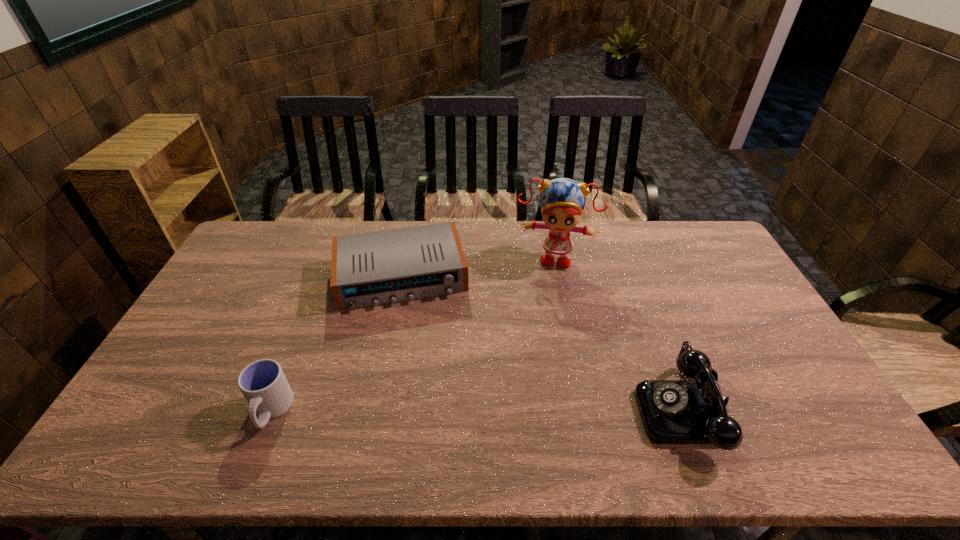
At what (x,y) coordinates should I click in order to perform the action: click on vacant space on the desktop that is between the cup and the telephone and is positioned on the front panel of the shortest object. Please return your answer as a coordinate pair (x, y). The height and width of the screenshot is (540, 960). Looking at the image, I should click on (419, 410).

Where is `free spot on the desktop that is between the cup and the telephone and is positioned on the face of the tallest object`? The image size is (960, 540). free spot on the desktop that is between the cup and the telephone and is positioned on the face of the tallest object is located at coordinates (540, 410).